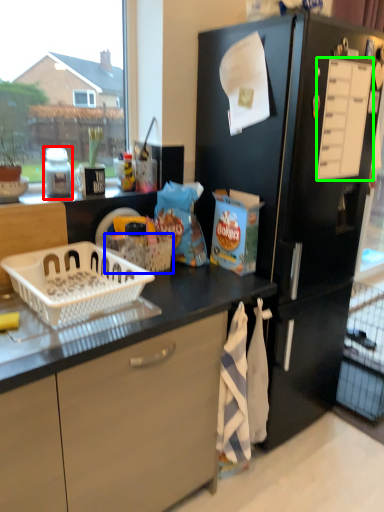
Question: Estimate the real-world distances between objects in this image. Which object is farther from bottle (highlighted by a red box), basket (highlighted by a blue box) or drawer (highlighted by a green box)?

Choices:
 (A) basket
 (B) drawer

Answer: (B)